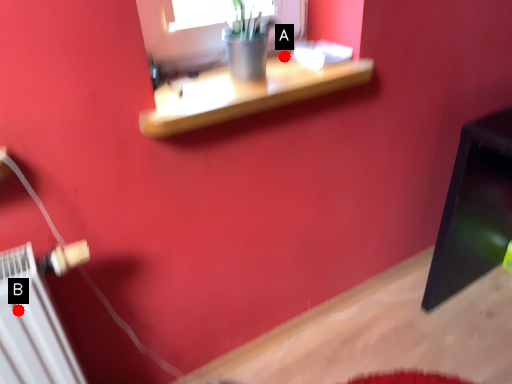
Question: Two points are circled on the image, labeled by A and B beside each circle. Among these points, which one is nearest to the camera?

Choices:
 (A) A is closer
 (B) B is closer

Answer: (B)